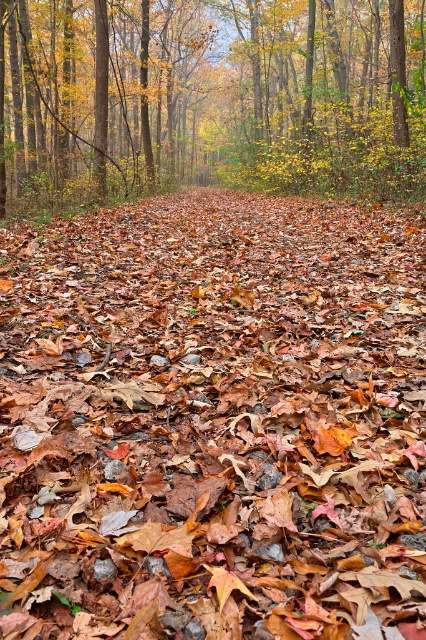
Is brown leaf litter at center thinner than yellow-green foliage at center?

Yes.

Which is below, brown leaf litter at center or yellow-green foliage at center?

brown leaf litter at center

Image resolution: width=426 pixels, height=640 pixels. What do you see at coordinates (213, 420) in the screenshot?
I see `brown leaf litter at center` at bounding box center [213, 420].

Identify the location of brown leaf litter at center. (213, 420).